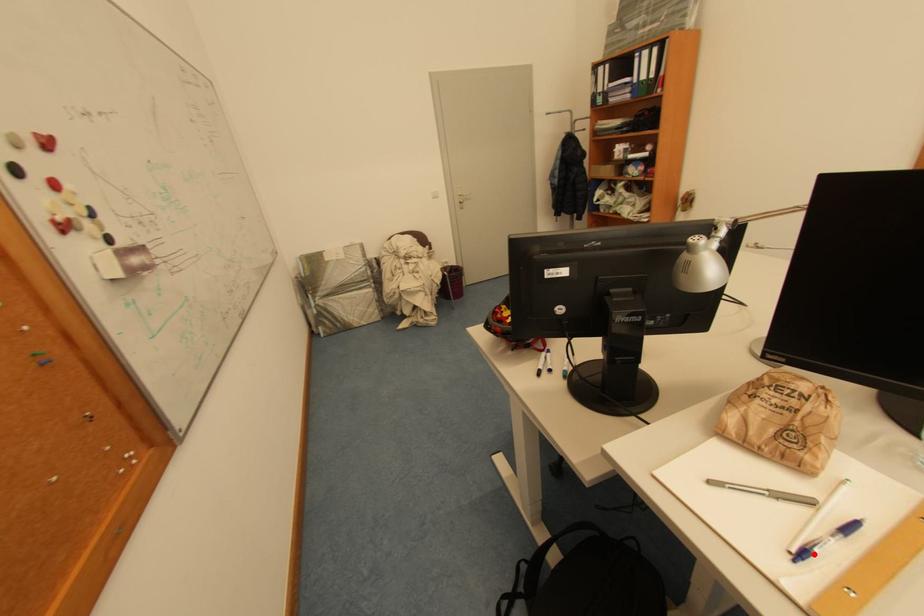
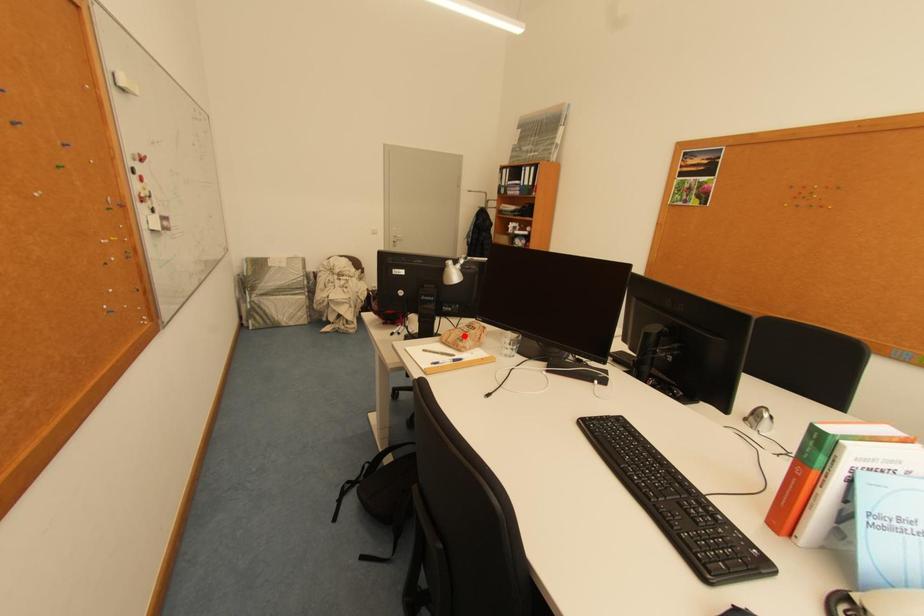
I am providing you with two images of the same scene from different viewpoints. A red point is marked on the first image and another point is marked on the second image. Are the points marked in image1 and image2 representing the same 3D position?

No